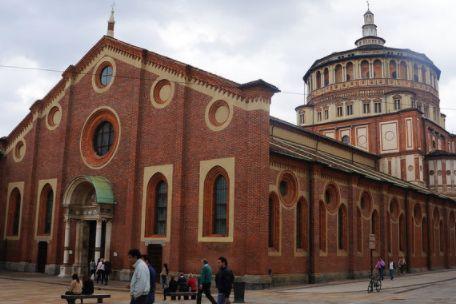
Identify the location of window. (106, 143).